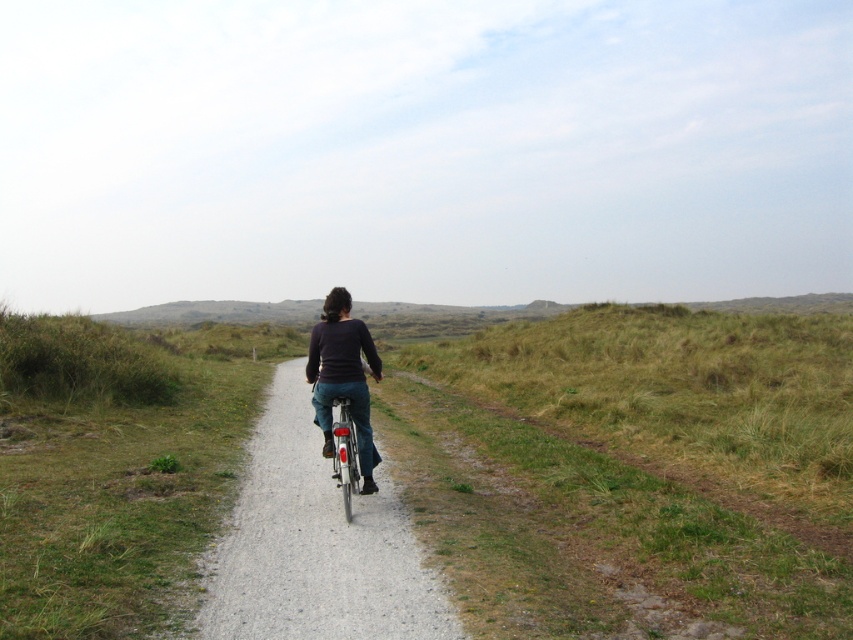
Does matte black bicycle at center have a greater height compared to shiny silver bicycle at center?

No, matte black bicycle at center is not taller than shiny silver bicycle at center.

Does matte black bicycle at center have a lesser height compared to shiny silver bicycle at center?

Yes, matte black bicycle at center is shorter than shiny silver bicycle at center.

Is point (253, 579) in front of point (346, 476)?

Yes, it is.

Locate an element on the screen. matte black bicycle at center is located at coordinates (315, 545).

Does point (733, 538) lie in front of point (305, 570)?

No, (733, 538) is further to viewer.

Locate an element on the screen. green grassy at right is located at coordinates (634, 468).

Does point (761, 579) come in front of point (341, 412)?

Yes, point (761, 579) is in front of point (341, 412).

Does green grassy at right have a lesser width compared to shiny silver bicycle at center?

In fact, green grassy at right might be wider than shiny silver bicycle at center.

Does point (776, 614) come behind point (349, 408)?

No, (776, 614) is closer to viewer.

The width and height of the screenshot is (853, 640). Find the location of `green grassy at right`. green grassy at right is located at coordinates (634, 468).